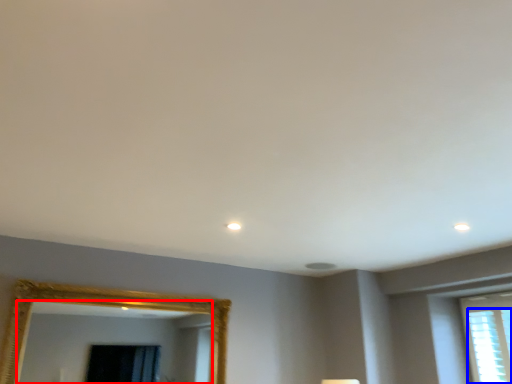
Question: Which object is closer to the camera taking this photo, mirror (highlighted by a red box) or window (highlighted by a blue box)?

Choices:
 (A) mirror
 (B) window

Answer: (A)